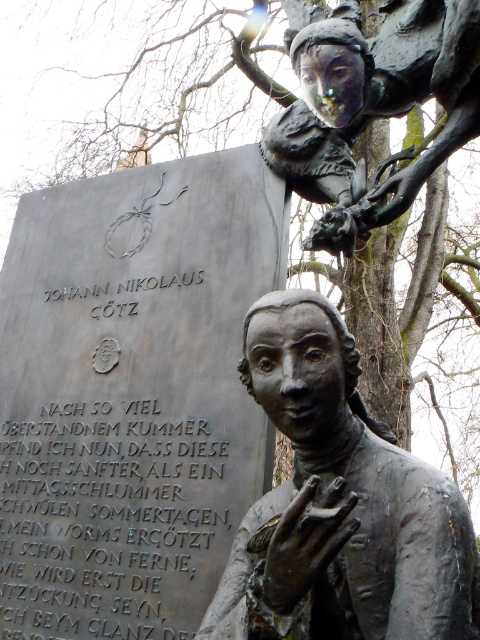
Does bronze statue at center appear under bronze statue at upper right?

Yes, bronze statue at center is below bronze statue at upper right.

The height and width of the screenshot is (640, 480). What do you see at coordinates (338, 504) in the screenshot?
I see `bronze statue at center` at bounding box center [338, 504].

Where is `bronze statue at center`? This screenshot has width=480, height=640. bronze statue at center is located at coordinates (338, 504).